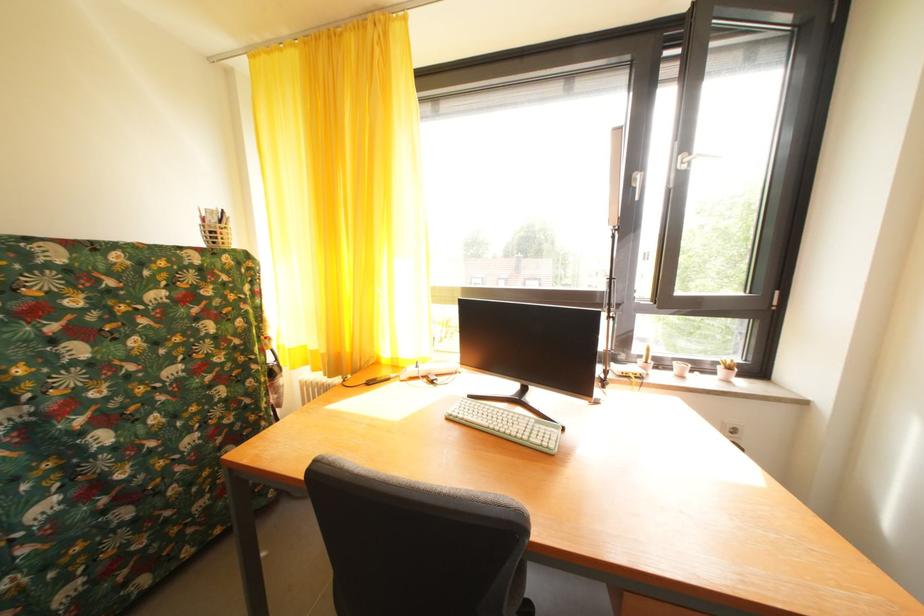
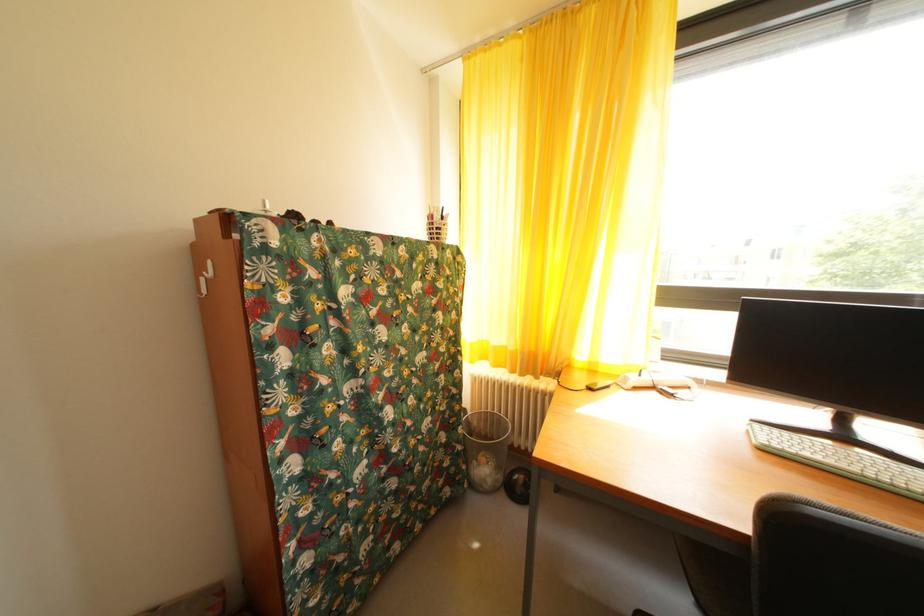
Question: The camera is either moving clockwise (left) or counter-clockwise (right) around the object. The first image is from the beginning of the video and the second image is from the end. Is the camera moving left or right when shooting the video?

Choices:
 (A) Left
 (B) Right

Answer: (B)